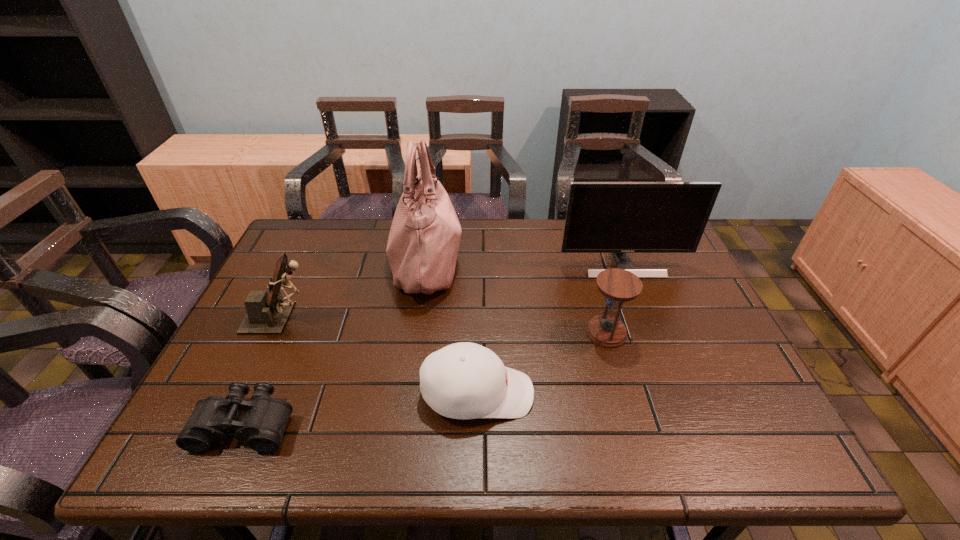
Locate an element on the screen. Image resolution: width=960 pixels, height=540 pixels. free spot between the tallest object and the fifth shortest object is located at coordinates (524, 262).

Image resolution: width=960 pixels, height=540 pixels. I want to click on vacant area that lies between the tallest object and the fourth tallest object, so click(516, 296).

Locate an element on the screen. free area in between the figurine and the hourglass is located at coordinates (444, 325).

Find the location of a particular element. This screenshot has width=960, height=540. the second closest object to the monitor is located at coordinates (422, 248).

What are the coordinates of `object that stands as the closest to the fourth shortest object` in the screenshot? It's located at (422, 248).

Image resolution: width=960 pixels, height=540 pixels. What are the coordinates of `free space that satisfies the following two spatial constraints: 1. on the screen side of the second tallest object; 2. on the front-facing side of the third tallest object` in the screenshot? It's located at (643, 318).

Locate an element on the screen. The height and width of the screenshot is (540, 960). vacant region that satisfies the following two spatial constraints: 1. on the screen side of the monitor; 2. on the front-facing side of the figurine is located at coordinates click(643, 318).